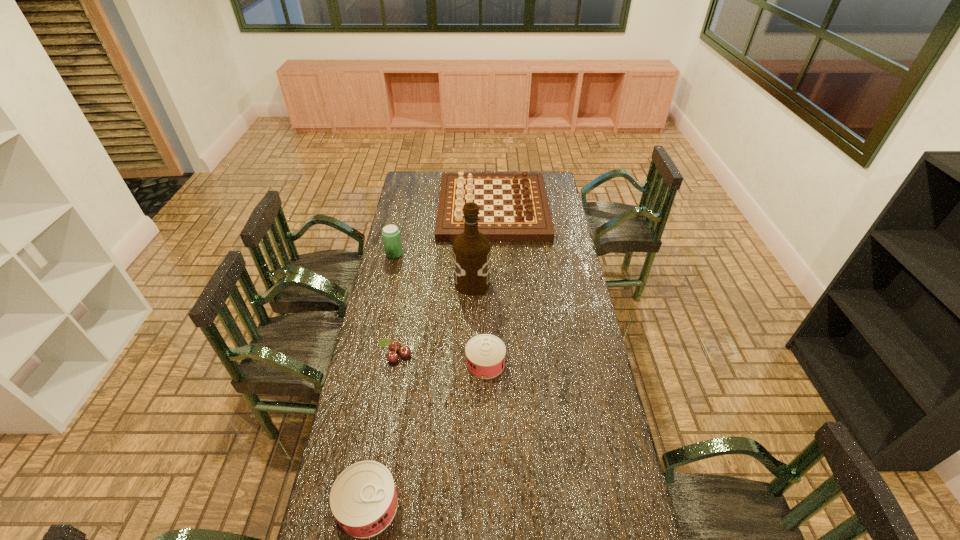
Where is `free location that satisfies the following two spatial constraints: 1. on the side with the white pieces of the gameboard; 2. on the front side of the nearest object`? free location that satisfies the following two spatial constraints: 1. on the side with the white pieces of the gameboard; 2. on the front side of the nearest object is located at coordinates (505, 505).

Locate an element on the screen. Image resolution: width=960 pixels, height=540 pixels. free spot that satisfies the following two spatial constraints: 1. on the side with the white pieces of the farthest object; 2. on the leaves of the cherry is located at coordinates (499, 355).

Locate an element on the screen. This screenshot has width=960, height=540. free point that satisfies the following two spatial constraints: 1. on the label of the tallest object; 2. on the left side of the shorter can is located at coordinates (470, 363).

At what (x,y) coordinates should I click in order to perform the action: click on blank area in the image that satisfies the following two spatial constraints: 1. on the label of the third farthest object; 2. on the right side of the shortest object. Please return your answer as a coordinate pair (x, y). Image resolution: width=960 pixels, height=540 pixels. Looking at the image, I should click on (470, 363).